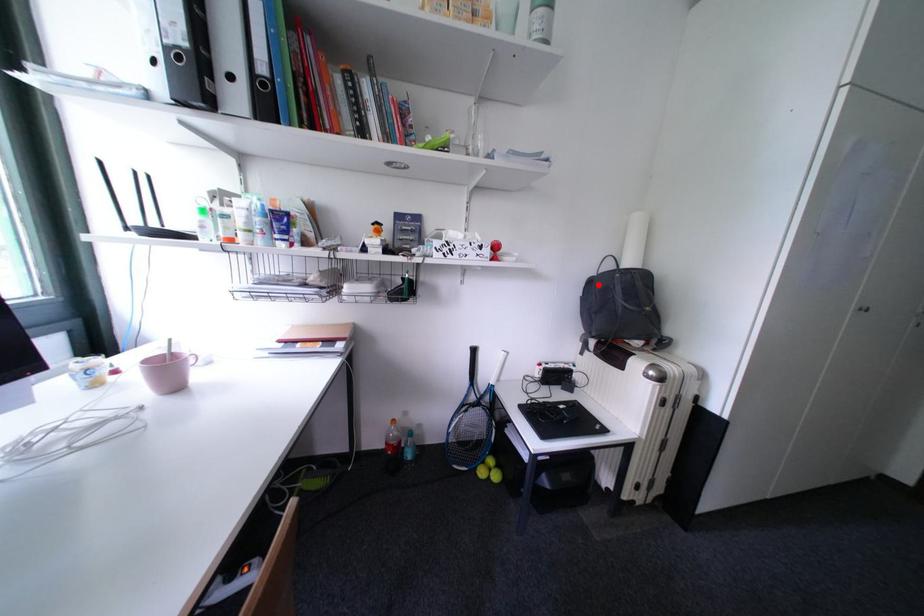
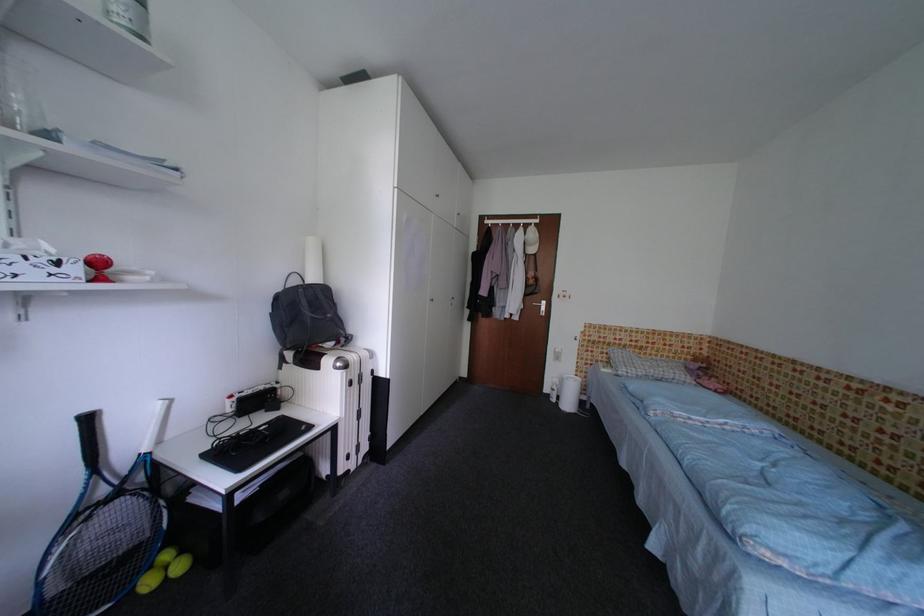
Question: I am providing you with two images of the same scene from different viewpoints. A red point is marked on the first image. Can you still see the location of the red point in image 2?

Choices:
 (A) Yes
 (B) No

Answer: (A)